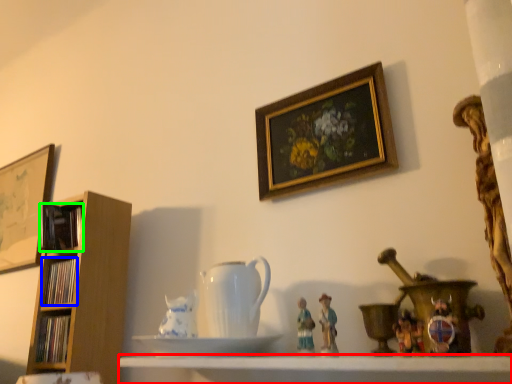
Question: Based on their relative distances, which object is farther from shelf (highlighted by a red box)? Choose from book (highlighted by a blue box) and book (highlighted by a green box).

Choices:
 (A) book
 (B) book

Answer: (B)